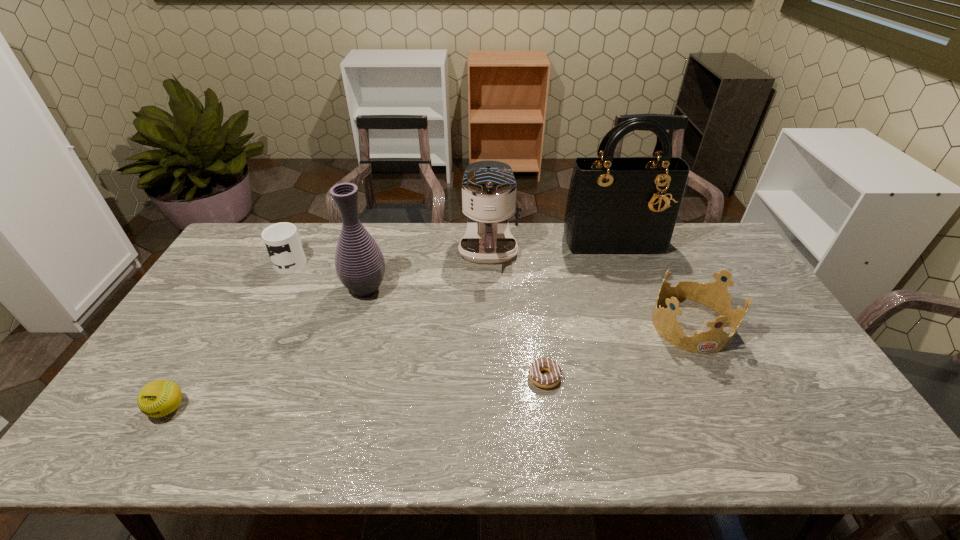
This screenshot has height=540, width=960. Find the location of `coffee maker present at the far edge`. coffee maker present at the far edge is located at coordinates (489, 188).

Image resolution: width=960 pixels, height=540 pixels. Find the location of `mug that is positioned at the far edge`. mug that is positioned at the far edge is located at coordinates click(283, 241).

Identify the location of object present at the near edge. This screenshot has height=540, width=960. (158, 398).

Where is `object that is at the left edge`? object that is at the left edge is located at coordinates (158, 398).

At what (x,y) coordinates should I click in order to perform the action: click on object at the right edge. Please return your answer as a coordinate pair (x, y). This screenshot has width=960, height=540. Looking at the image, I should click on (715, 295).

This screenshot has height=540, width=960. Find the location of `object that is at the near left corner`. object that is at the near left corner is located at coordinates (158, 398).

Where is `vacant space at the far edge of the desktop`? The width and height of the screenshot is (960, 540). vacant space at the far edge of the desktop is located at coordinates (540, 242).

Where is `free space at the near edge`? Image resolution: width=960 pixels, height=540 pixels. free space at the near edge is located at coordinates (576, 443).

At what (x,y) coordinates should I click in order to perform the action: click on free location at the left edge. Please return your answer as a coordinate pair (x, y). Image resolution: width=960 pixels, height=540 pixels. Looking at the image, I should click on (224, 270).

In the image, there is a desktop. Find the location of `vacant space at the far right corner`. vacant space at the far right corner is located at coordinates (692, 258).